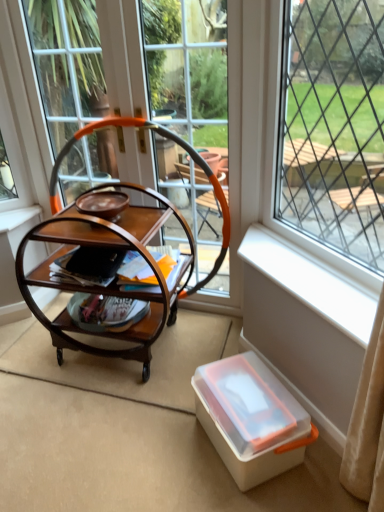
In order to face wooden trolley at center, should I rotate leftwards or rightwards?

It's best to rotate left around 10.962 degrees.

Where is `matte brown plate at center`? Image resolution: width=384 pixels, height=512 pixels. matte brown plate at center is located at coordinates (102, 203).

What is the approximate width of translucent plastic box at lower right?

translucent plastic box at lower right is 15.20 inches wide.

The width and height of the screenshot is (384, 512). I want to click on matte brown magazine at center, so click(140, 285).

What is the approximate width of clear glass window at center, which appears as the first window when viewed from the left?

clear glass window at center, which appears as the first window when viewed from the left, is 4.97 centimeters wide.

The image size is (384, 512). Identify the location of wooden trolley at center. (111, 282).

Considering the sizes of objects wooden/marble-like rocking chair at center and translucent plastic box at lower right in the image provided, who is smaller, wooden/marble-like rocking chair at center or translucent plastic box at lower right?

Answer: translucent plastic box at lower right.

Find the location of a particular element. box lying on the right of wooden/marble-like rocking chair at center is located at coordinates (251, 419).

From the picture: Is translucent plastic box at lower right inside wooden/marble-like rocking chair at center?

Actually, translucent plastic box at lower right is outside wooden/marble-like rocking chair at center.

Based on the photo, between translucent plastic box at lower right and wooden trolley at center, which one appears on the left side from the viewer's perspective?

Positioned to the left is wooden trolley at center.

Can you confirm if translucent plastic box at lower right is smaller than wooden trolley at center?

Yes.

Consider the image. Between matte brown plate at center and white plastic window sill at lower right, which one has more height?

Standing taller between the two is white plastic window sill at lower right.

From a real-world perspective, is matte brown plate at center positioned above or below white plastic window sill at lower right?

In terms of real-world spatial position, matte brown plate at center is above white plastic window sill at lower right.

From the image's perspective, would you say matte brown plate at center is shown under white plastic window sill at lower right?

Actually, matte brown plate at center appears above white plastic window sill at lower right in the image.

Considering the sizes of objects matte brown plate at center and white plastic window sill at lower right in the image provided, who is thinner, matte brown plate at center or white plastic window sill at lower right?

matte brown plate at center is thinner.

Which object is positioned more to the left, clear glass window at center, which is counted as the 2th window, starting from the right, or wooden trolley at center?

wooden trolley at center.

From their relative heights in the image, would you say clear glass window at center, which appears as the first window when viewed from the left, is taller or shorter than wooden trolley at center?

Considering their sizes, clear glass window at center, which appears as the first window when viewed from the left, has more height than wooden trolley at center.

Is clear glass window at center, which is counted as the 2th window, starting from the right, surrounding wooden trolley at center?

Definitely not — wooden trolley at center is not inside clear glass window at center, which is counted as the 2th window, starting from the right.

Is clear glass window at center, which is counted as the 2th window, starting from the right, positioned far away from wooden trolley at center?

No.

Is matte brown magazine at center taller than translucent plastic box at lower right?

Incorrect, the height of matte brown magazine at center is not larger of that of translucent plastic box at lower right.

Considering the relative sizes of matte brown magazine at center and translucent plastic box at lower right in the image provided, is matte brown magazine at center smaller than translucent plastic box at lower right?

Yes.

From the image's perspective, who appears lower, matte brown magazine at center or translucent plastic box at lower right?

translucent plastic box at lower right appears lower in the image.

Locate an element on the screen. This screenshot has width=384, height=512. box to the right of matte brown magazine at center is located at coordinates (251, 419).

Which is more to the right, transparent plastic window at center, the 1th window viewed from the right, or matte brown magazine at center?

Positioned to the right is transparent plastic window at center, the 1th window viewed from the right.

Could you measure the distance between transparent plastic window at center, the 2th window in the left-to-right sequence, and matte brown magazine at center?

transparent plastic window at center, the 2th window in the left-to-right sequence, and matte brown magazine at center are 4.53 feet apart.

Is transparent plastic window at center, the 1th window viewed from the right, oriented towards matte brown magazine at center?

Yes, transparent plastic window at center, the 1th window viewed from the right, is oriented towards matte brown magazine at center.

Consider the image. Is transparent plastic window at center, the 2th window in the left-to-right sequence, taller than matte brown magazine at center?

Correct, transparent plastic window at center, the 2th window in the left-to-right sequence, is much taller as matte brown magazine at center.

Is wooden trolley at center far from transparent plastic window at center, the 1th window viewed from the right?

Yes.

Is wooden trolley at center in front of or behind transparent plastic window at center, the 1th window viewed from the right, in the image?

In the image, wooden trolley at center appears behind transparent plastic window at center, the 1th window viewed from the right.

Is point (50, 227) more distant than point (289, 57)?

Yes, it is behind point (289, 57).

Find the location of a particular element. The image size is (384, 512). rocking chair to the left of translucent plastic box at lower right is located at coordinates (176, 143).

The height and width of the screenshot is (512, 384). What are the coordinates of `desk above the translucent plastic box at lower right (from a real-world perspective)` in the screenshot? It's located at (111, 282).

Considering their positions, is wooden trolley at center positioned closer to matte brown plate at center than transparent plastic window at center, the 1th window viewed from the right?

wooden trolley at center is closer to matte brown plate at center.

Looking at the image, which one is located further to clear glass window at center, which appears as the first window when viewed from the left, transparent plastic window at center, the 2th window in the left-to-right sequence, or wooden trolley at center?

Based on the image, transparent plastic window at center, the 2th window in the left-to-right sequence, appears to be further to clear glass window at center, which appears as the first window when viewed from the left.

Considering their positions, is matte brown plate at center positioned closer to translucent plastic box at lower right than wooden trolley at center?

wooden trolley at center lies closer to translucent plastic box at lower right than the other object.

Considering their positions, is translucent plastic box at lower right positioned further to matte brown magazine at center than wooden/marble-like rocking chair at center?

translucent plastic box at lower right is further to matte brown magazine at center.

From the image, which object appears to be nearer to transparent plastic window at center, the 2th window in the left-to-right sequence, matte brown plate at center or white plastic window sill at lower right?

The object closer to transparent plastic window at center, the 2th window in the left-to-right sequence, is white plastic window sill at lower right.

When comparing their distances from white plastic window sill at lower right, does translucent plastic box at lower right or clear glass window at center, which appears as the first window when viewed from the left, seem further?

Among the two, translucent plastic box at lower right is located further to white plastic window sill at lower right.

Based on their spatial positions, is matte brown plate at center or white plastic window sill at lower right closer to clear glass window at center, which appears as the first window when viewed from the left?

The object closer to clear glass window at center, which appears as the first window when viewed from the left, is white plastic window sill at lower right.

From the image, which object appears to be nearer to matte brown plate at center, wooden/marble-like rocking chair at center or clear glass window at center, which is counted as the 2th window, starting from the right?

wooden/marble-like rocking chair at center is positioned closer to the anchor matte brown plate at center.

At what (x,y) coordinates should I click in order to perform the action: click on window between wooden trolley at center and transparent plastic window at center, the 1th window viewed from the right, from left to right. Please return your answer as a coordinate pair (x, y). Image resolution: width=384 pixels, height=512 pixels. Looking at the image, I should click on (259, 144).

Image resolution: width=384 pixels, height=512 pixels. Identify the location of magazine between matte brown plate at center and wooden trolley at center in the up-down direction. (140, 285).

Where is `desk between transparent plastic window at center, the 2th window in the left-to-right sequence, and translucent plastic box at lower right, in the vertical direction`? desk between transparent plastic window at center, the 2th window in the left-to-right sequence, and translucent plastic box at lower right, in the vertical direction is located at coordinates (111, 282).

What are the coordinates of `magazine located between transparent plastic window at center, the 1th window viewed from the right, and matte brown plate at center in the depth direction` in the screenshot? It's located at (140, 285).